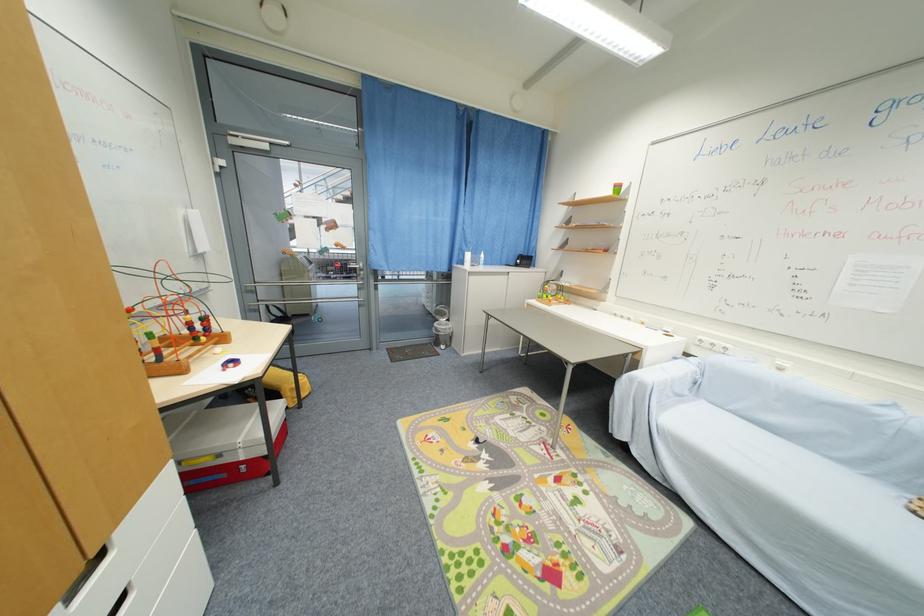
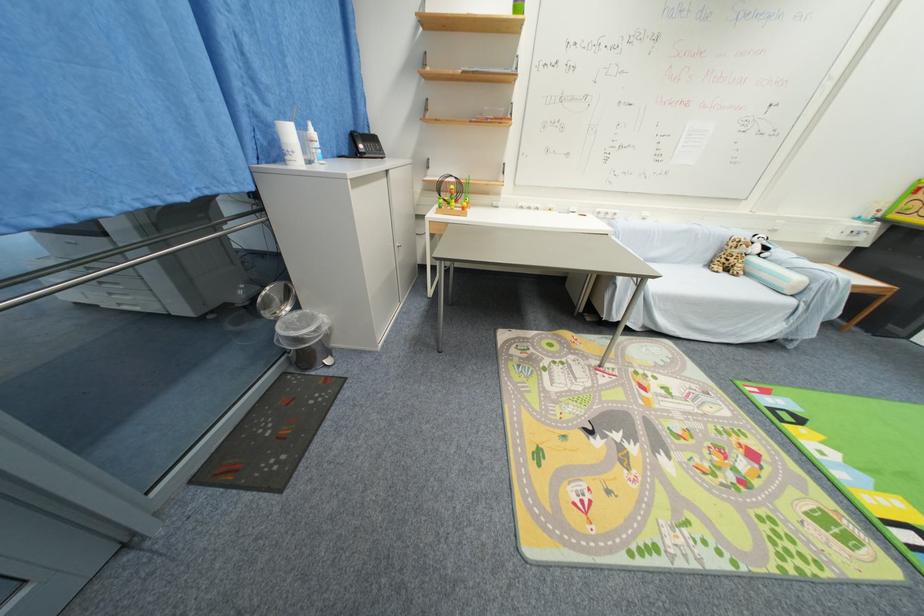
The point at (454, 322) is marked in the first image. Where is the corresponding point in the second image?

(301, 309)